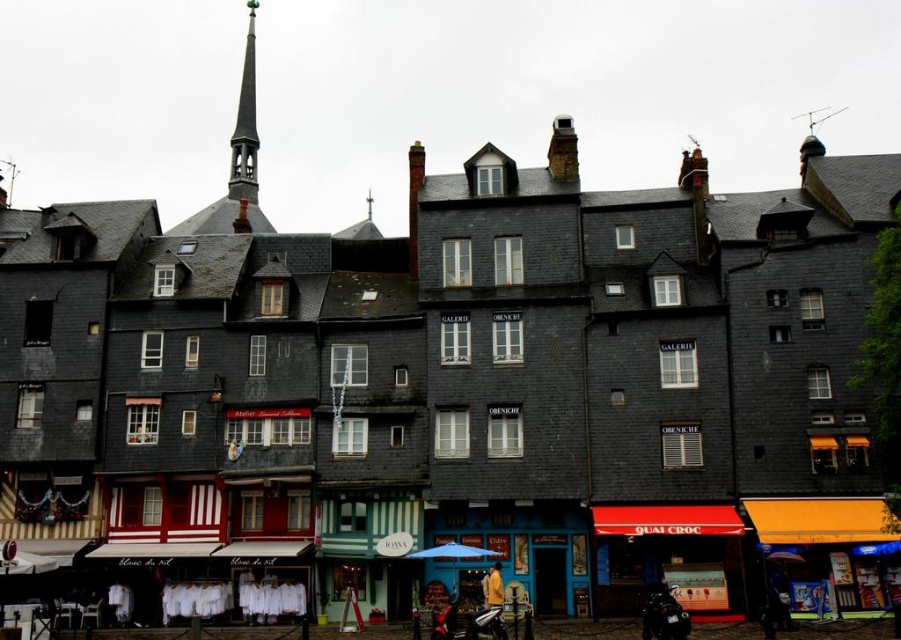
Question: Does white cotton laundry at center appear over blue fabric umbrella at center?

Choices:
 (A) no
 (B) yes

Answer: (A)

Question: Which point appears farthest from the camera in this image?

Choices:
 (A) (444, 545)
 (B) (775, 525)
 (C) (535, 586)

Answer: (A)

Question: Which point is closer to the camera?

Choices:
 (A) blue painted wooden shop at center
 (B) orange fabric awning at lower right
 (C) red awning at lower right
 (D) smooth gray spire at upper left

Answer: (B)

Question: Which of these objects is positioned farthest from the red awning at lower right?

Choices:
 (A) blue fabric umbrella at center
 (B) smooth gray spire at upper left
 (C) orange fabric awning at lower right

Answer: (B)

Question: In this image, where is blue painted wooden shop at center located relative to white cotton laundry at center?

Choices:
 (A) above
 (B) below

Answer: (A)

Question: Can you confirm if blue painted wooden shop at center is positioned to the left of white cotton laundry at center?

Choices:
 (A) no
 (B) yes

Answer: (A)